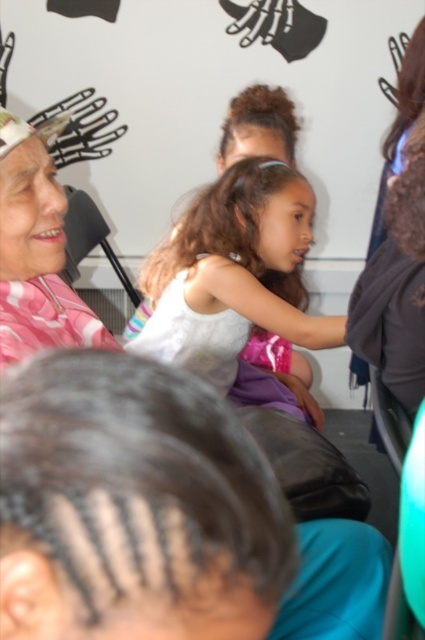
Can you confirm if white satin dress at center is positioned to the right of pink plaid shirt at upper left?

Indeed, white satin dress at center is positioned on the right side of pink plaid shirt at upper left.

Between white satin dress at center and pink plaid shirt at upper left, which one has less height?

pink plaid shirt at upper left

Who is more forward, (224, 392) or (104, 344)?

Positioned in front is point (104, 344).

This screenshot has width=425, height=640. What are the coordinates of `white satin dress at center` in the screenshot? It's located at (234, 273).